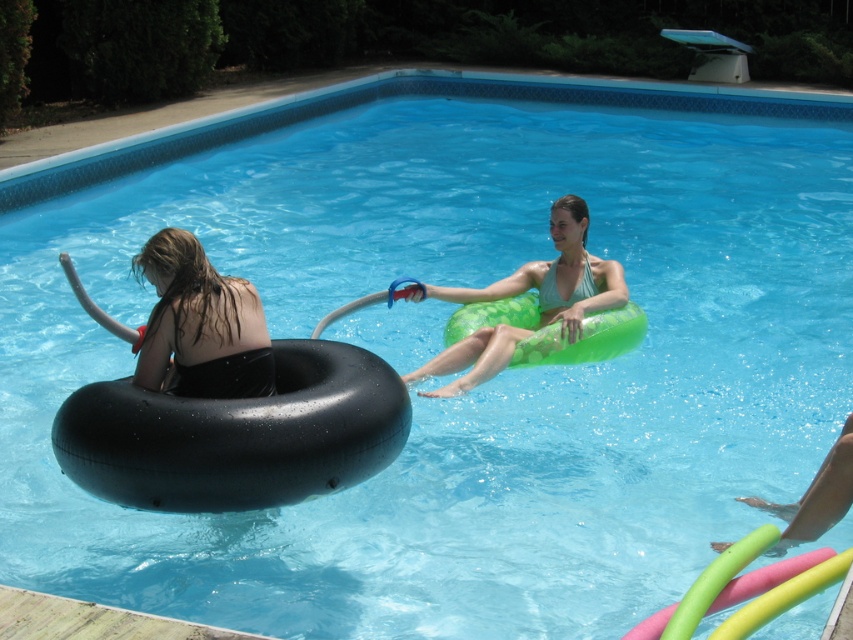
You are standing at the edge of the pool and want to retrieve both the black rubber tube at left and the green rubber ring at center. Which one would you reach first if you extend your arm straight out?

The black rubber tube at left is below the green rubber ring at center, so you would reach the black rubber tube at left first since it is closer to your arm when extending it straight out.

You are a lifeguard standing at the edge of the pool and need to reach the black rubber tube at left and the green rubber ring at center to check their safety. If your maximum reach is 1.6 meters, can you grab both items without moving from your current position?

The black rubber tube at left is 1.59 meters away from the green rubber ring at center. Since the distance between them is within your 1.6 meter reach, you can grab both items without moving.